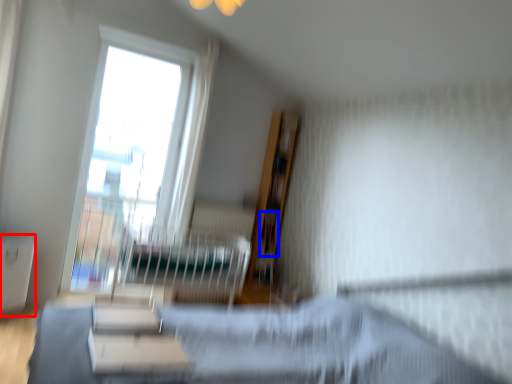
Question: Which object appears closest to the camera in this image, table (highlighted by a red box) or book (highlighted by a blue box)?

Choices:
 (A) table
 (B) book

Answer: (A)